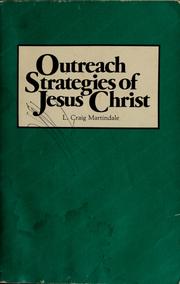
Locate an element on the screen. This screenshot has width=180, height=284. green part of book is located at coordinates (76, 193).